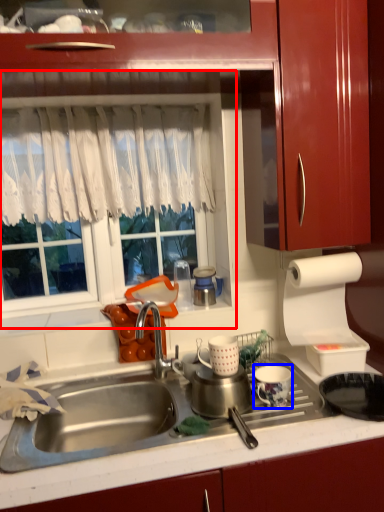
Question: Which of the following is the closest to the observer, window screen (highlighted by a red box) or tableware (highlighted by a blue box)?

Choices:
 (A) window screen
 (B) tableware

Answer: (B)